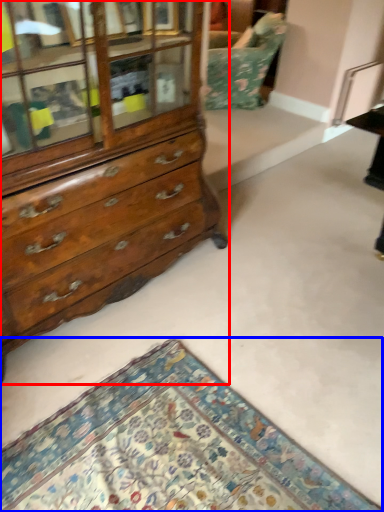
Question: Which point is closer to the camera, chest of drawers (highlighted by a red box) or mat (highlighted by a blue box)?

Choices:
 (A) chest of drawers
 (B) mat

Answer: (B)